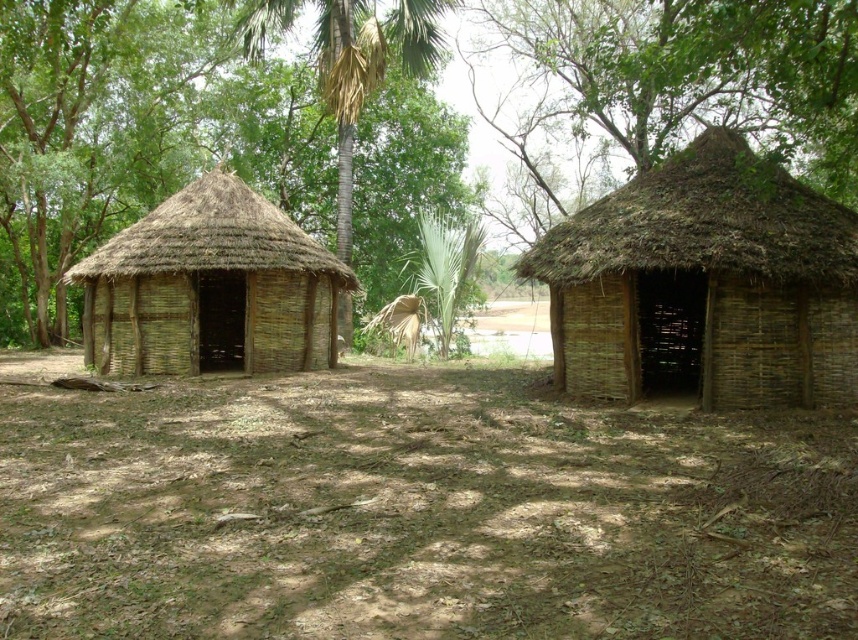
You are standing at the origin point of the coordinate system in the image. You need to locate the brown dirt field at center. Which direction should you move in to reach it?

The brown dirt field at center is located at the coordinate point 0.800 on the x axis and 0.483 on the y axis. Since you are at the origin point, you should move towards the positive x and positive y direction to reach it.

You are a farmer who needs to plant crops in the brown dirt field at center. You have a tractor that is 3 meters wide. Can your tractor fit through the space between the brown thatch hut at right and the nearest tree? Please explain your reasoning.

The brown dirt field at center might be wider than brown thatch hut at right. However, the description does not provide specific measurements for the width of the field or the distance between the hut and the nearest tree. Without this information, it is impossible to determine if the tractor can fit. More details about the spatial dimensions are needed to answer accurately.

You are standing in the forest near the two round huts. You see two points marked on the ground at coordinates point (705, 547) and point (756, 108). If you were to walk from the first point to the second, would you be moving towards the huts or away from them?

Since point (705, 547) is in front of point (756, 108), walking from the first point to the second would mean moving away from the huts.